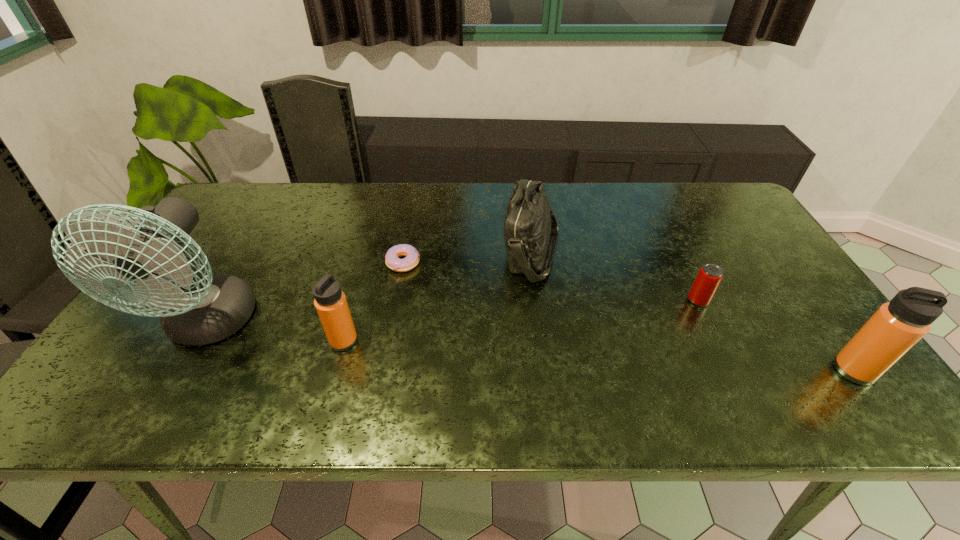
I want to click on object present at the left edge, so click(x=202, y=309).

The height and width of the screenshot is (540, 960). What are the coordinates of `object situated at the right edge` in the screenshot? It's located at (898, 325).

I want to click on object at the near left corner, so [x=202, y=309].

Locate an element on the screen. This screenshot has width=960, height=540. object present at the near right corner is located at coordinates (898, 325).

This screenshot has height=540, width=960. I want to click on vacant space at the far edge of the desktop, so click(x=374, y=220).

The image size is (960, 540). In the image, there is a desktop. Find the location of `vacant area at the near edge`. vacant area at the near edge is located at coordinates (241, 374).

Where is `vacant space at the left edge of the desktop`? vacant space at the left edge of the desktop is located at coordinates (144, 329).

You are a GUI agent. You are given a task and a screenshot of the screen. Output one action in this format:
    pyautogui.click(x=<x>, y=<y>)
    Task: Click on the free space at the right edge
    The image size is (960, 540).
    Given the screenshot: What is the action you would take?
    pyautogui.click(x=720, y=231)

Locate an element on the screen. unoccupied position between the shoulder bag and the doughnut is located at coordinates pos(468,258).

At what (x,y) coordinates should I click in order to perform the action: click on free space that is in between the beer can and the farther thermos bottle. Please return your answer as a coordinate pair (x, y). The image size is (960, 540). Looking at the image, I should click on (521, 321).